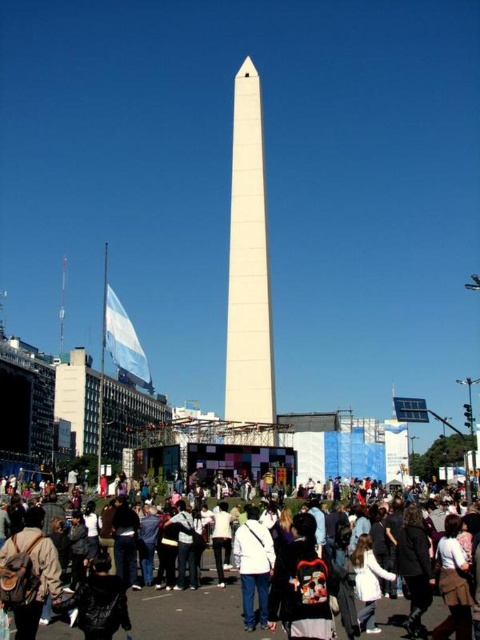
Looking at this image, can you confirm if white smooth obelisk at center is shorter than white matte jacket at center?

No, white smooth obelisk at center is not shorter than white matte jacket at center.

The width and height of the screenshot is (480, 640). I want to click on white smooth obelisk at center, so click(x=248, y=266).

Locate an element on the screen. white smooth obelisk at center is located at coordinates (248, 266).

Which is above, matte black backpacks at lower center or white matte jacket at center?

Positioned higher is white matte jacket at center.

The height and width of the screenshot is (640, 480). What are the coordinates of `matte black backpacks at lower center` in the screenshot? It's located at (192, 612).

Is point (240, 243) closer to camera compared to point (429, 609)?

No, (240, 243) is behind (429, 609).

Can you confirm if white smooth obelisk at center is positioned to the left of matte black backpacks at lower center?

Correct, you'll find white smooth obelisk at center to the left of matte black backpacks at lower center.

Is point (236, 241) in front of point (199, 596)?

No.

This screenshot has height=640, width=480. Identify the location of white smooth obelisk at center. (248, 266).